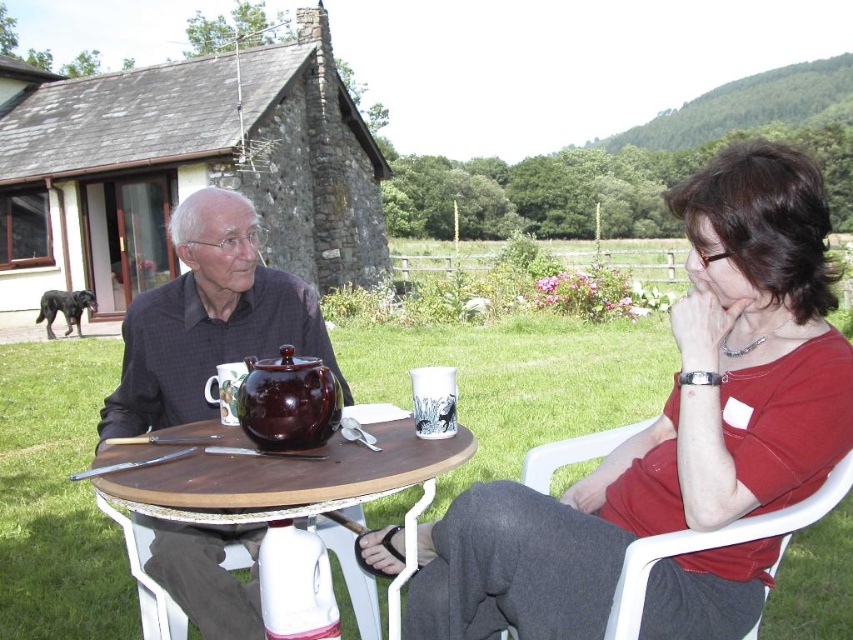
You are a photographer trying to capture a closeup of the matte black shirt at center and the white plastic chair at right. Since you want to focus on the shirt, which object should you ensure is closer to the camera?

The matte black shirt at center is bigger than the white plastic chair at right, so to focus on the shirt, you should position it closer to the camera.

You are a photographer wanting to capture both the matte red shirt at center and the brown glossy teapot at center in a single frame. Since you want both subjects to be clearly visible, which object should you focus on first to ensure depth of field? Explain your reasoning based on their positions.

The matte red shirt at center is much taller than the brown glossy teapot at center. To ensure both are in focus, you should focus on the matte red shirt at center first because it is farther away from the camera than the teapot. This way, the depth of field will extend from the shirt to the teapot, keeping both sharp.

You are standing at the center of the scene. Which direction should you move to reach the white plastic chair at right?

The white plastic chair at right is located at point (x=715, y=545), which is to the right side of the scene. Therefore, you should move to the right to reach it.